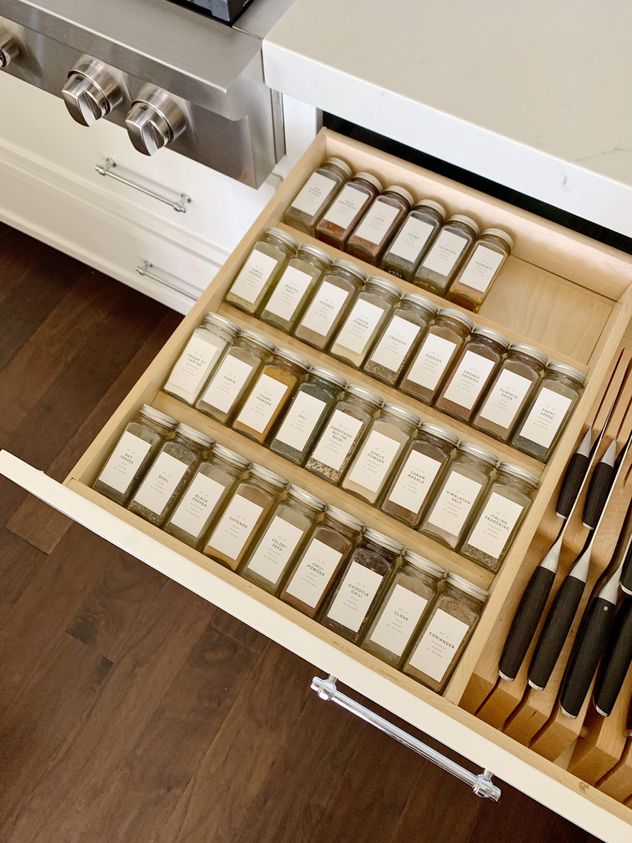
In order to click on spice drawer in this screenshot , I will do `click(521, 307)`.